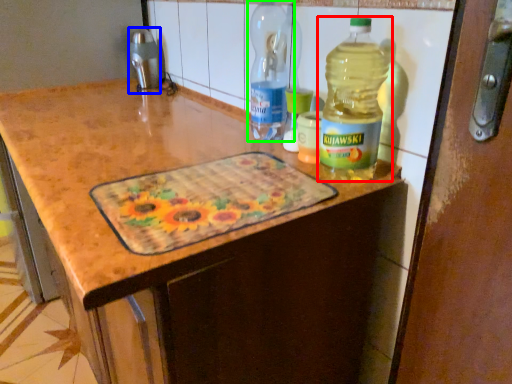
Question: Which object is positioned farthest from bottle (highlighted by a red box)? Select from appliance (highlighted by a blue box) and bottle (highlighted by a green box).

Choices:
 (A) appliance
 (B) bottle

Answer: (A)